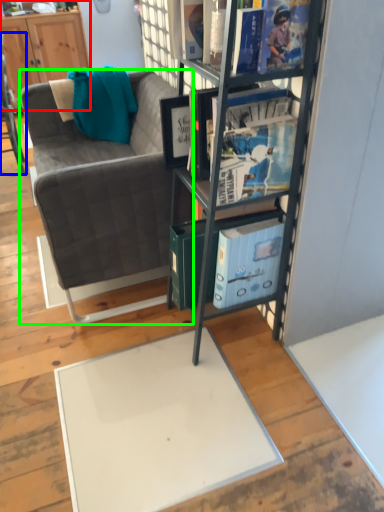
Question: Which is nearer to the cabinetry (highlighted by a red box)? chair (highlighted by a blue box) or studio couch (highlighted by a green box).

Choices:
 (A) chair
 (B) studio couch

Answer: (A)